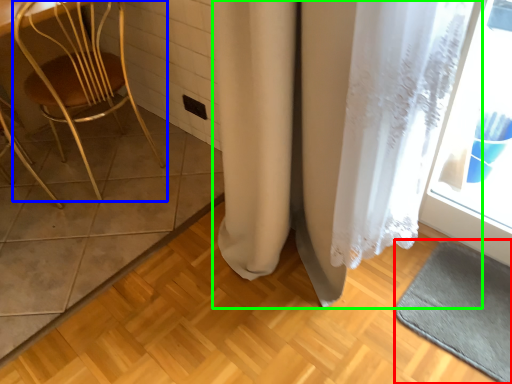
Question: Based on their relative distances, which object is farther from bath mat (highlighted by a red box)? Choose from chair (highlighted by a blue box) and curtain (highlighted by a green box).

Choices:
 (A) chair
 (B) curtain

Answer: (A)